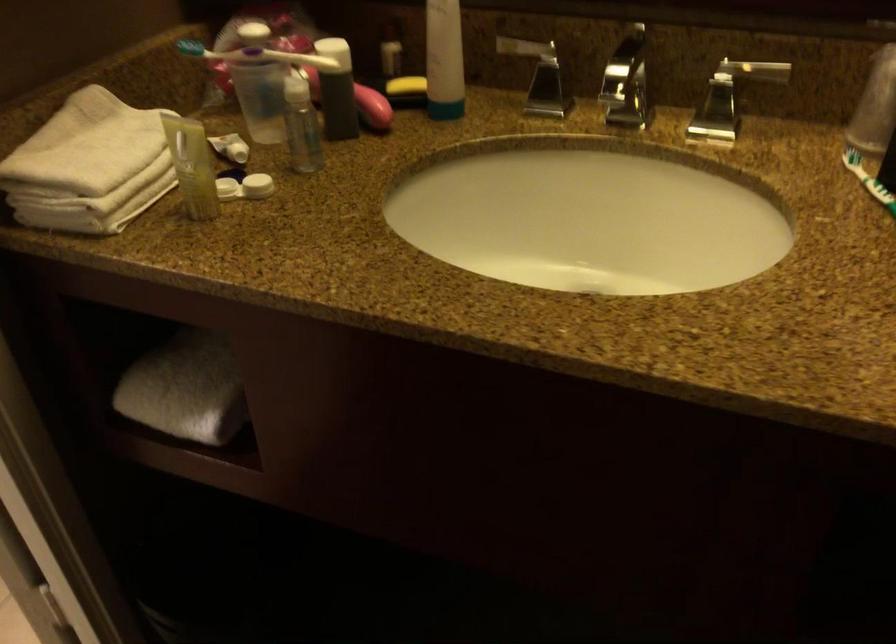
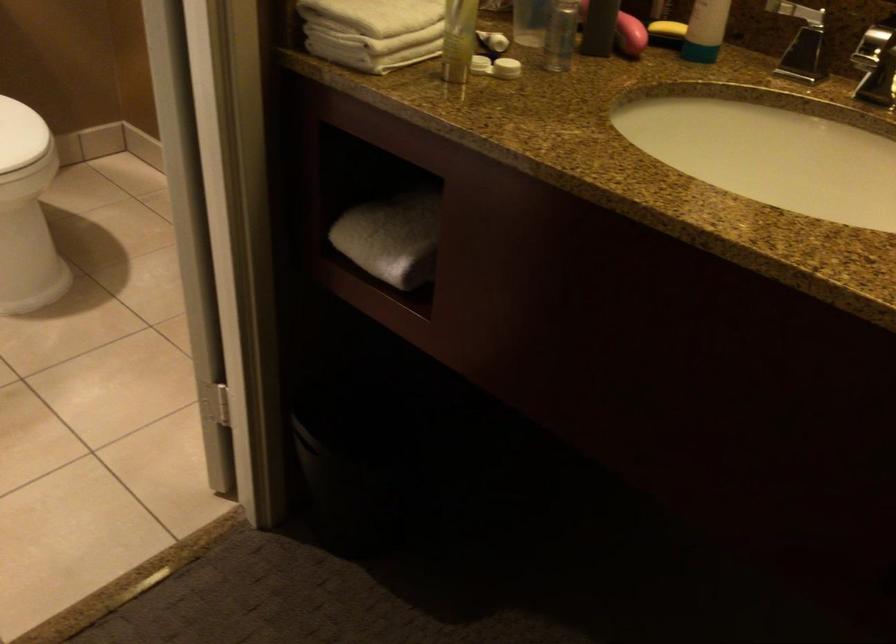
Find the pixel in the second image that matches (x=372, y=109) in the first image.

(630, 35)